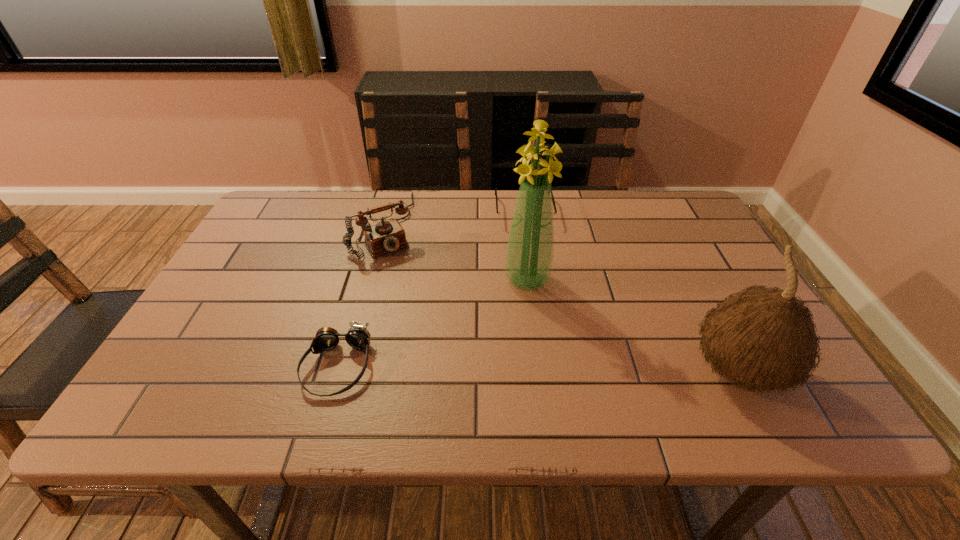
Locate an element on the screen. vacant space on the desktop that is between the goggles and the rightmost object and is positioned on the front-facing side of the bouquet is located at coordinates (515, 369).

Image resolution: width=960 pixels, height=540 pixels. Identify the location of vacant space on the desktop that is between the goggles and the second tallest object and is positioned on the dial of the third tallest object. (481, 368).

Where is `vacant space on the desktop that is between the goggles and the coconut and is positioned at the hinge ends of the spectacles`? Image resolution: width=960 pixels, height=540 pixels. vacant space on the desktop that is between the goggles and the coconut and is positioned at the hinge ends of the spectacles is located at coordinates (544, 369).